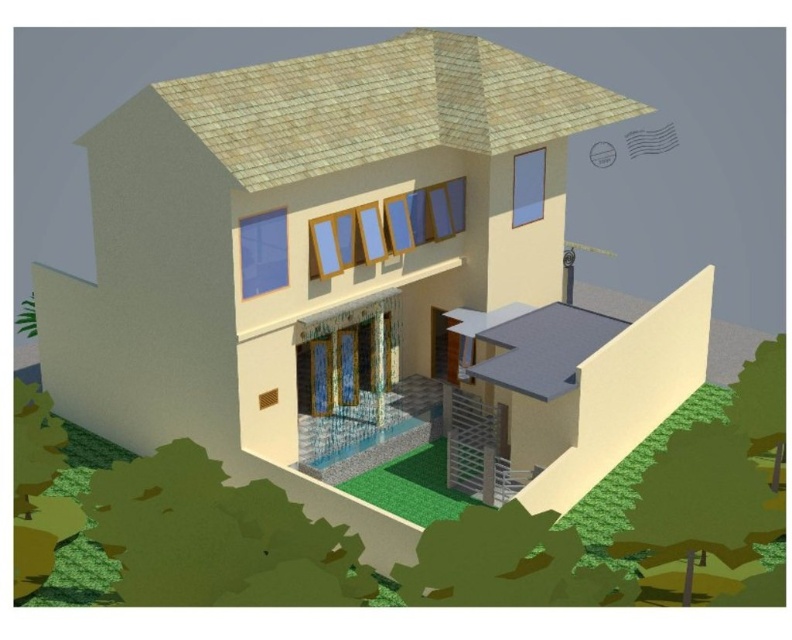
From the picture: You are a delivery person trying to locate the matte gray mailbox at upper right and the matte gray chimney at upper right on the house. Since both are on the upper right, which one is bigger?

The matte gray mailbox at upper right is larger in size compared to the matte gray chimney at upper right.

You are a delivery person approaching the house and need to locate the matte gray mailbox at upper right and the matte gray chimney at upper right. Based on the architectural design, which one is positioned higher up on the house?

The matte gray mailbox at upper right is located above the matte gray chimney at upper right, so it is positioned higher up on the house.

You are a mail carrier delivering a package to this house. You see the matte gray mailbox at upper right and the matte gray chimney at upper right. Which one is positioned further to the right side of the house?

The matte gray mailbox at upper right is positioned further to the right side of the house compared to the matte gray chimney at upper right.